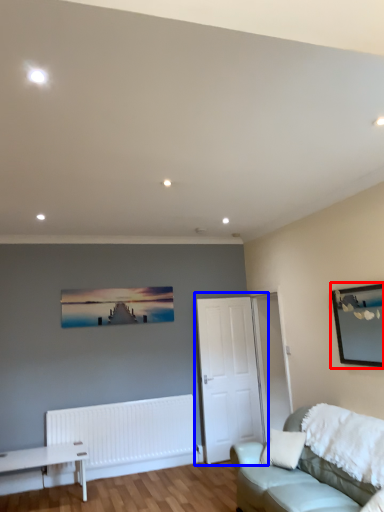
Question: Which of the following is the farthest to the observer, picture frame (highlighted by a red box) or door (highlighted by a blue box)?

Choices:
 (A) picture frame
 (B) door

Answer: (B)